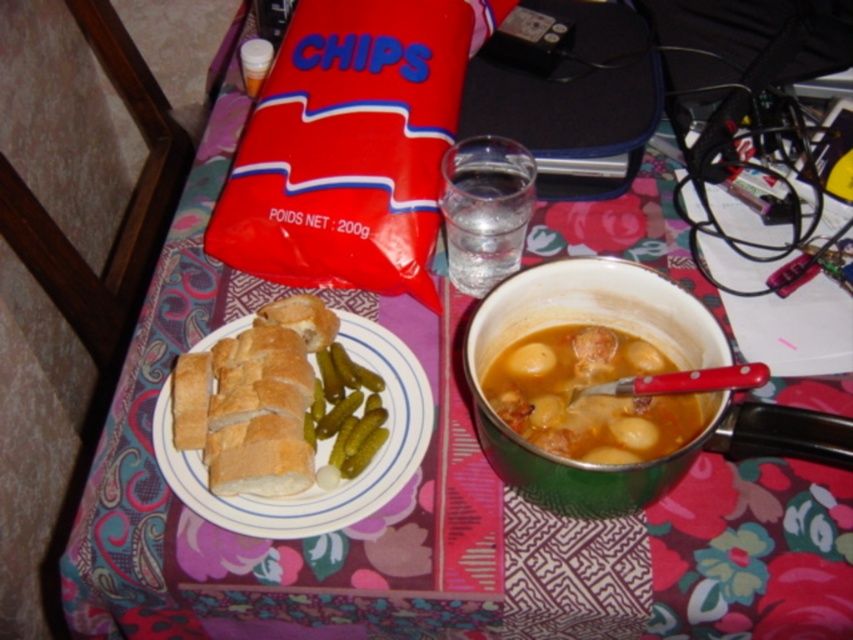
Which is above, white ceramic plate at center or clear glass water at center?

Positioned higher is clear glass water at center.

How much distance is there between white ceramic plate at center and clear glass water at center?

They are 6.72 inches apart.

The height and width of the screenshot is (640, 853). Find the location of `white ceramic plate at center`. white ceramic plate at center is located at coordinates (314, 483).

Can you confirm if green enamel bowl at center is wider than white ceramic plate at center?

No.

Is green enamel bowl at center closer to camera compared to white ceramic plate at center?

Yes, green enamel bowl at center is in front of white ceramic plate at center.

I want to click on green enamel bowl at center, so 599,324.

Is green enamel bowl at center further to the viewer compared to clear glass water at center?

That is False.

Does green enamel bowl at center appear on the left side of clear glass water at center?

No, green enamel bowl at center is not to the left of clear glass water at center.

Between point (689, 358) and point (469, 188), which one is positioned behind?

Point (469, 188)

This screenshot has height=640, width=853. What are the coordinates of `green enamel bowl at center` in the screenshot? It's located at (599, 324).